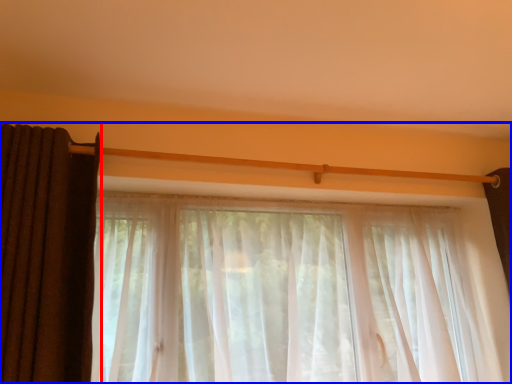
Question: Which of the following is the farthest to the observer, curtain (highlighted by a red box) or curtain (highlighted by a blue box)?

Choices:
 (A) curtain
 (B) curtain

Answer: (B)